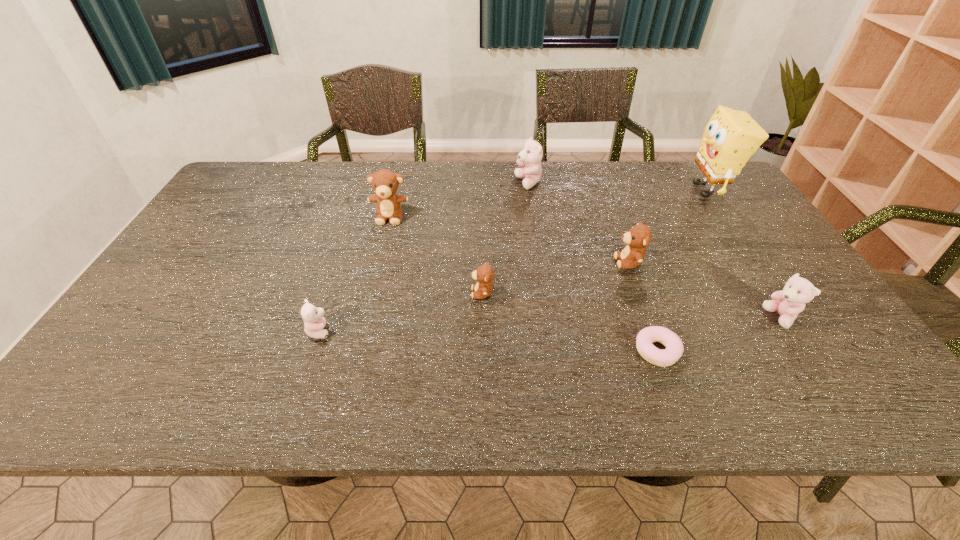
At what (x,y) coordinates should I click in order to perform the action: click on the fourth farthest teddy bear. Please return your answer as a coordinate pair (x, y). Looking at the image, I should click on (484, 274).

Identify the location of the fourth teddy bear from right to left. The image size is (960, 540). (484, 274).

The width and height of the screenshot is (960, 540). I want to click on the leftmost object, so click(314, 322).

The width and height of the screenshot is (960, 540). What are the coordinates of `the leftmost pink teddy bear` in the screenshot? It's located at (314, 322).

This screenshot has height=540, width=960. What are the coordinates of `the shortest object` in the screenshot? It's located at (674, 347).

The image size is (960, 540). Find the location of `doughnut`. doughnut is located at coordinates (x=674, y=347).

I want to click on free spot located on the face of the sponge, so click(x=634, y=190).

I want to click on free space located 0.220m on the face of the sponge, so click(x=618, y=190).

The image size is (960, 540). I want to click on free spot located on the face of the sponge, so 655,190.

Where is `vacant space located 0.100m at the face of the farthest teddy bear`? Image resolution: width=960 pixels, height=540 pixels. vacant space located 0.100m at the face of the farthest teddy bear is located at coordinates (485, 183).